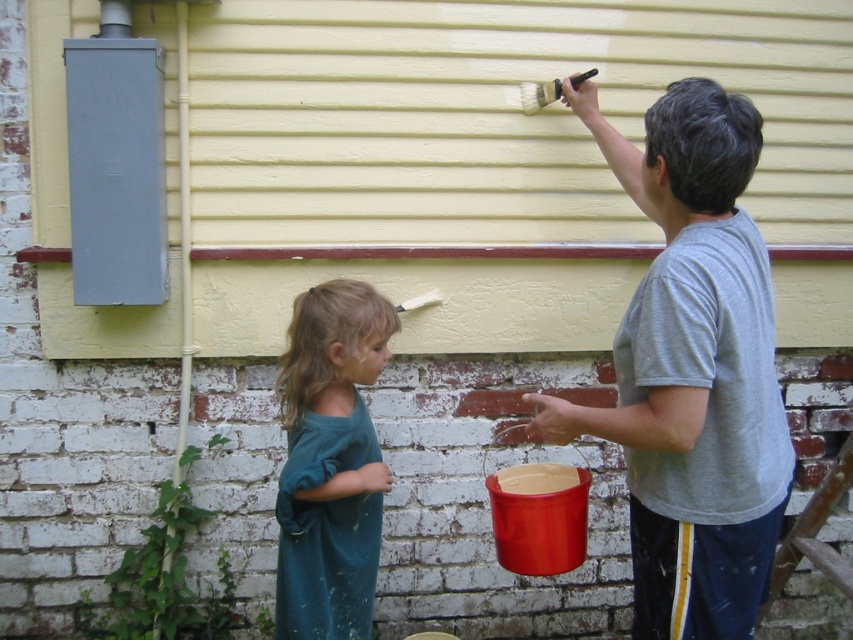
Question: Does matte gray shirt at upper right have a larger size compared to teal fabric shirt at lower left?

Choices:
 (A) no
 (B) yes

Answer: (B)

Question: Among these objects, which one is nearest to the camera?

Choices:
 (A) matte gray shirt at upper right
 (B) teal fabric shirt at lower left

Answer: (A)

Question: Which point is farther to the camera?

Choices:
 (A) (293, 314)
 (B) (746, 349)

Answer: (A)

Question: Does matte gray shirt at upper right have a smaller size compared to teal fabric shirt at lower left?

Choices:
 (A) no
 (B) yes

Answer: (A)

Question: Can you confirm if matte gray shirt at upper right is positioned above teal fabric shirt at lower left?

Choices:
 (A) yes
 (B) no

Answer: (A)